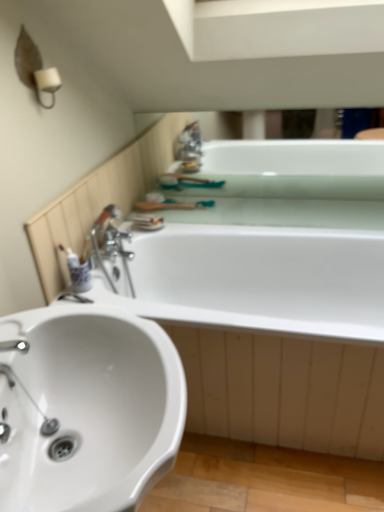
Question: Is white glossy bathtub at upper center, the first bath when ordered from top to bottom, bigger than white glossy toothbrush at left?

Choices:
 (A) yes
 (B) no

Answer: (A)

Question: Does white glossy bathtub at upper center, the first bath when ordered from top to bottom, appear on the left side of white glossy toothbrush at left?

Choices:
 (A) yes
 (B) no

Answer: (B)

Question: From the image's perspective, is white glossy bathtub at upper center, the second bath from the bottom, below white glossy toothbrush at left?

Choices:
 (A) yes
 (B) no

Answer: (B)

Question: Can you confirm if white glossy bathtub at upper center, the first bath when ordered from top to bottom, is taller than white glossy toothbrush at left?

Choices:
 (A) yes
 (B) no

Answer: (A)

Question: From a real-world perspective, is white glossy bathtub at upper center, the second bath from the bottom, positioned over white glossy toothbrush at left based on gravity?

Choices:
 (A) yes
 (B) no

Answer: (A)

Question: From the image's perspective, relative to white glossy sink at lower left, is white glossy bathtub at upper center, the second bath from the bottom, above or below?

Choices:
 (A) above
 (B) below

Answer: (A)

Question: Is white glossy bathtub at upper center, the first bath when ordered from top to bottom, bigger or smaller than white glossy sink at lower left?

Choices:
 (A) big
 (B) small

Answer: (B)

Question: Is white glossy bathtub at upper center, the first bath when ordered from top to bottom, situated inside white glossy sink at lower left or outside?

Choices:
 (A) inside
 (B) outside

Answer: (B)

Question: Would you say white glossy bathtub at upper center, the first bath when ordered from top to bottom, is to the left or to the right of white glossy sink at lower left in the picture?

Choices:
 (A) left
 (B) right

Answer: (B)

Question: Is white glossy toothbrush at left in front of or behind white glossy sink at lower left in the image?

Choices:
 (A) front
 (B) behind

Answer: (B)

Question: From a real-world perspective, is white glossy toothbrush at left above or below white glossy sink at lower left?

Choices:
 (A) below
 (B) above

Answer: (B)

Question: Visually, is white glossy toothbrush at left positioned to the left or to the right of white glossy sink at lower left?

Choices:
 (A) right
 (B) left

Answer: (B)

Question: Which is correct: white glossy toothbrush at left is inside white glossy sink at lower left, or outside of it?

Choices:
 (A) outside
 (B) inside

Answer: (A)

Question: Is white glossy bathtub at upper center, the second bath from the bottom, to the left or to the right of white glossy toothbrush at left in the image?

Choices:
 (A) right
 (B) left

Answer: (A)

Question: Considering the positions of white glossy bathtub at upper center, the first bath when ordered from top to bottom, and white glossy toothbrush at left in the image, is white glossy bathtub at upper center, the first bath when ordered from top to bottom, bigger or smaller than white glossy toothbrush at left?

Choices:
 (A) big
 (B) small

Answer: (A)